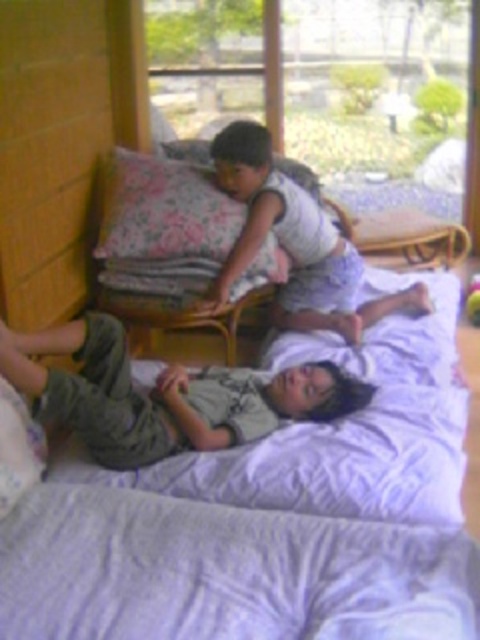
Question: In this image, where is green cotton pants at lower center located relative to white cotton shirt at upper center?

Choices:
 (A) below
 (B) above

Answer: (A)

Question: Can you confirm if green cotton pants at lower center is smaller than white cotton shirt at upper center?

Choices:
 (A) yes
 (B) no

Answer: (A)

Question: Which of the following is the closest to the observer?

Choices:
 (A) (316, 609)
 (B) (137, 444)

Answer: (A)

Question: Can you confirm if white soft bed at lower center is positioned below white cotton shirt at upper center?

Choices:
 (A) no
 (B) yes

Answer: (B)

Question: Among these points, which one is nearest to the camera?

Choices:
 (A) (157, 396)
 (B) (32, 564)

Answer: (B)

Question: Which point is farther from the camera taking this photo?

Choices:
 (A) (26, 497)
 (B) (320, 253)

Answer: (B)